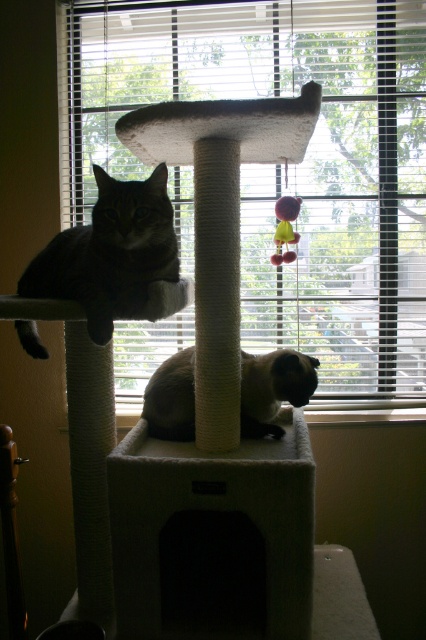
Is tabby fur cat at upper left smaller than smokey gray fur at center?

No.

Is tabby fur cat at upper left bigger than smokey gray fur at center?

Indeed, tabby fur cat at upper left has a larger size compared to smokey gray fur at center.

Which is in front, point (170, 259) or point (181, 380)?

Point (170, 259) is in front.

This screenshot has height=640, width=426. Find the location of `tabby fur cat at upper left`. tabby fur cat at upper left is located at coordinates (x=109, y=253).

Is white carpeted cat tree at center shorter than smokey gray fur at center?

No.

In the scene shown: Who is lower down, white carpeted cat tree at center or smokey gray fur at center?

smokey gray fur at center is below.

Describe the element at coordinates (215, 417) in the screenshot. This screenshot has height=640, width=426. I see `white carpeted cat tree at center` at that location.

I want to click on white carpeted cat tree at center, so click(215, 417).

Who is taller, tabby fur cat at upper left or plush yellow catnip toy at center?

Standing taller between the two is tabby fur cat at upper left.

In the scene shown: Can you confirm if tabby fur cat at upper left is wider than plush yellow catnip toy at center?

Yes, tabby fur cat at upper left is wider than plush yellow catnip toy at center.

Is point (46, 298) farther from viewer compared to point (291, 234)?

That is False.

Locate an element on the screen. This screenshot has width=426, height=640. tabby fur cat at upper left is located at coordinates 109,253.